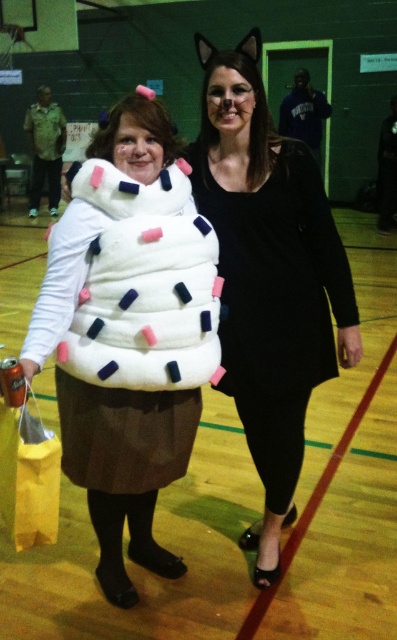
Is fuzzy white cupcake at center positioned behind black matte dress at center?

No, it is in front of black matte dress at center.

The height and width of the screenshot is (640, 397). Describe the element at coordinates (129, 330) in the screenshot. I see `fuzzy white cupcake at center` at that location.

Locate an element on the screen. fuzzy white cupcake at center is located at coordinates (129, 330).

Find the location of `fuzzy white cupcake at center`. fuzzy white cupcake at center is located at coordinates coord(129,330).